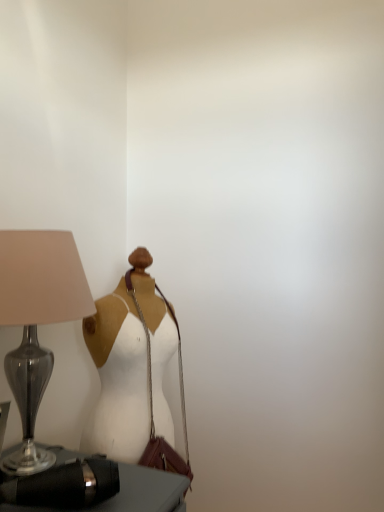
Question: Can you confirm if matte glass lamp at left is wider than black leather bag at lower left?

Choices:
 (A) yes
 (B) no

Answer: (A)

Question: From a real-world perspective, is matte glass lamp at left positioned over black leather bag at lower left based on gravity?

Choices:
 (A) no
 (B) yes

Answer: (B)

Question: Considering the relative sizes of matte glass lamp at left and black leather bag at lower left in the image provided, is matte glass lamp at left taller than black leather bag at lower left?

Choices:
 (A) yes
 (B) no

Answer: (A)

Question: Is matte glass lamp at left at the right side of black leather bag at lower left?

Choices:
 (A) yes
 (B) no

Answer: (B)

Question: Is matte glass lamp at left not near black leather bag at lower left?

Choices:
 (A) no
 (B) yes

Answer: (A)

Question: From the image's perspective, is black leather bag at lower left above or below matte glass lamp at left?

Choices:
 (A) below
 (B) above

Answer: (A)

Question: In terms of width, does black leather bag at lower left look wider or thinner when compared to matte glass lamp at left?

Choices:
 (A) thin
 (B) wide

Answer: (A)

Question: Is point (139, 507) positioned closer to the camera than point (4, 320)?

Choices:
 (A) farther
 (B) closer

Answer: (A)

Question: Is black leather bag at lower left spatially inside matte glass lamp at left, or outside of it?

Choices:
 (A) inside
 (B) outside

Answer: (A)

Question: Based on their sizes in the image, would you say black leather bag at lower left is bigger or smaller than leather shoulder bag at center?

Choices:
 (A) big
 (B) small

Answer: (B)

Question: Relative to leather shoulder bag at center, is black leather bag at lower left in front or behind?

Choices:
 (A) front
 (B) behind

Answer: (A)

Question: Choose the correct answer: Is black leather bag at lower left inside leather shoulder bag at center or outside it?

Choices:
 (A) inside
 (B) outside

Answer: (B)

Question: Looking at their shapes, would you say black leather bag at lower left is wider or thinner than leather shoulder bag at center?

Choices:
 (A) thin
 (B) wide

Answer: (B)

Question: Considering the positions of leather shoulder bag at center and white matte dress at center in the image, is leather shoulder bag at center bigger or smaller than white matte dress at center?

Choices:
 (A) big
 (B) small

Answer: (B)

Question: Is point (172, 464) positioned closer to the camera than point (134, 308)?

Choices:
 (A) farther
 (B) closer

Answer: (B)